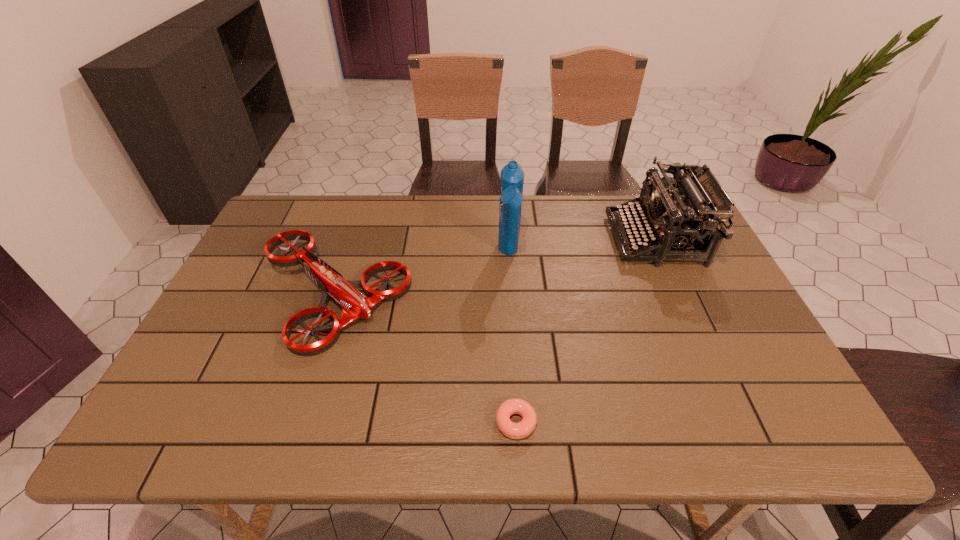
Identify the location of vacant space at the near edge of the desktop. The width and height of the screenshot is (960, 540). (682, 417).

I want to click on free space at the left edge of the desktop, so click(x=231, y=288).

Locate an element on the screen. The image size is (960, 540). vacant area at the right edge of the desktop is located at coordinates [727, 353].

The width and height of the screenshot is (960, 540). What are the coordinates of `vacant area that lies between the shortest object and the leftmost object` in the screenshot? It's located at (424, 359).

Locate an element on the screen. vacant area that lies between the nearest object and the typewriter is located at coordinates (586, 330).

The height and width of the screenshot is (540, 960). I want to click on free space between the typewriter and the nearest object, so click(x=586, y=330).

At what (x,y) coordinates should I click in order to perform the action: click on blank region between the shampoo and the doughnut. Please return your answer as a coordinate pair (x, y). The width and height of the screenshot is (960, 540). Looking at the image, I should click on (513, 338).

You are a GUI agent. You are given a task and a screenshot of the screen. Output one action in this format:
    pyautogui.click(x=<x>, y=<y>)
    Task: Click on the free point between the shortest object and the tallest object
    The height and width of the screenshot is (540, 960).
    Given the screenshot: What is the action you would take?
    pyautogui.click(x=513, y=338)

Find the location of a particular element. vacant point located between the doughnut and the leftmost object is located at coordinates (424, 359).

Locate an element on the screen. This screenshot has height=540, width=960. free space between the doughnut and the tallest object is located at coordinates (513, 338).